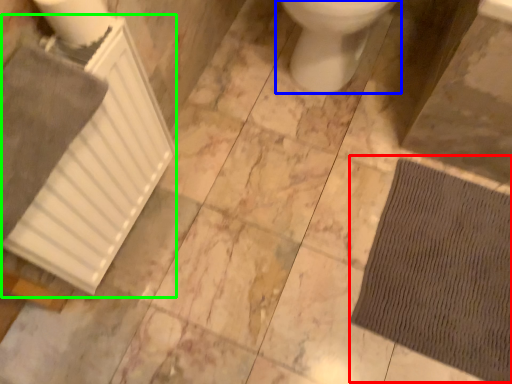
Question: Which object is positioned farthest from doormat (highlighted by a red box)? Select from toilet (highlighted by a blue box) and radiator (highlighted by a green box).

Choices:
 (A) toilet
 (B) radiator

Answer: (B)